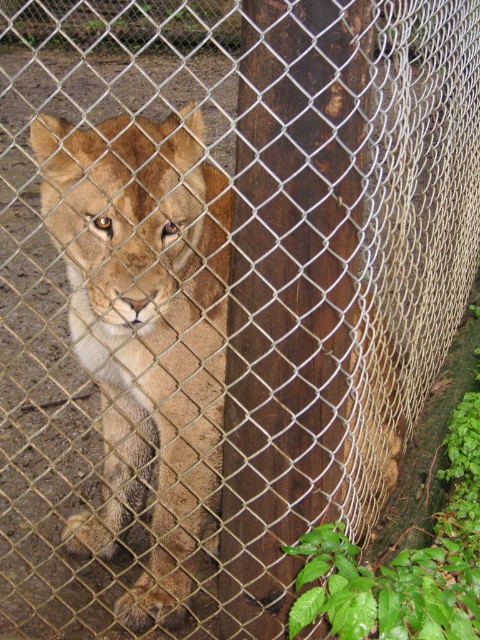
You are a zookeeper trying to locate the brown wood pole at center in the zoo enclosure. According to the coordinates provided, where would you find it?

The brown wood pole at center is located at point (x=289, y=294).

You are a zookeeper holding a 1.20 meter long tool. You need to reach the brown wood pole at center to secure some equipment. Can you reach it without moving closer? Please explain your reasoning.

The brown wood pole at center is 1.40 meters away from the viewer. Since the tool is only 1.20 meters long, it is not long enough to reach the pole from the current distance. You would need to move closer to within 1.20 meters or use a longer tool to secure the equipment.

You are a zookeeper who needs to place a new feeding tray for the golden fur lion at center. The feeding tray must be placed outside the area where the brown wood pole at center is located. Based on the scene, where should you position the feeding tray?

The brown wood pole at center is positioned over the golden fur lion at center, so the feeding tray should be placed outside the area directly under the pole to avoid blocking the lion or the pole.